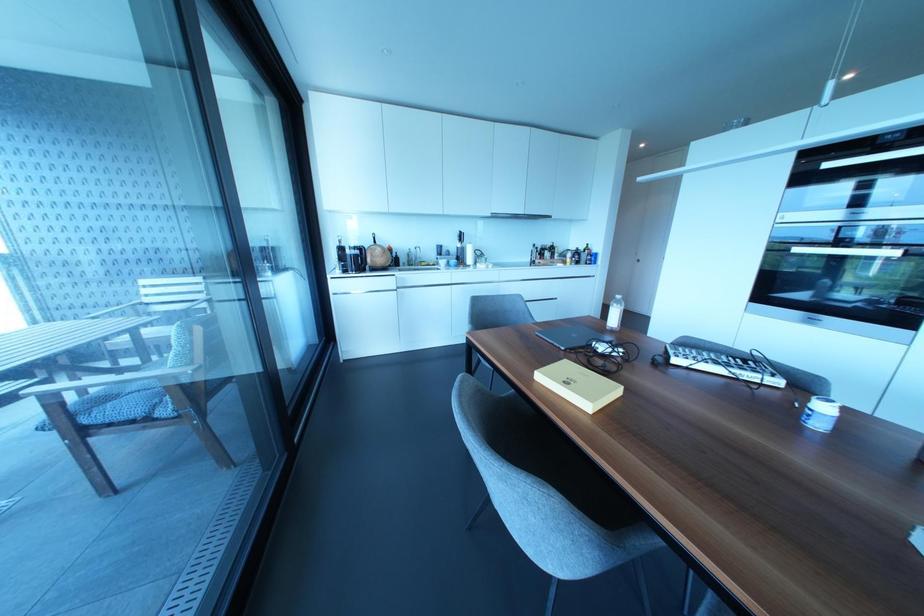
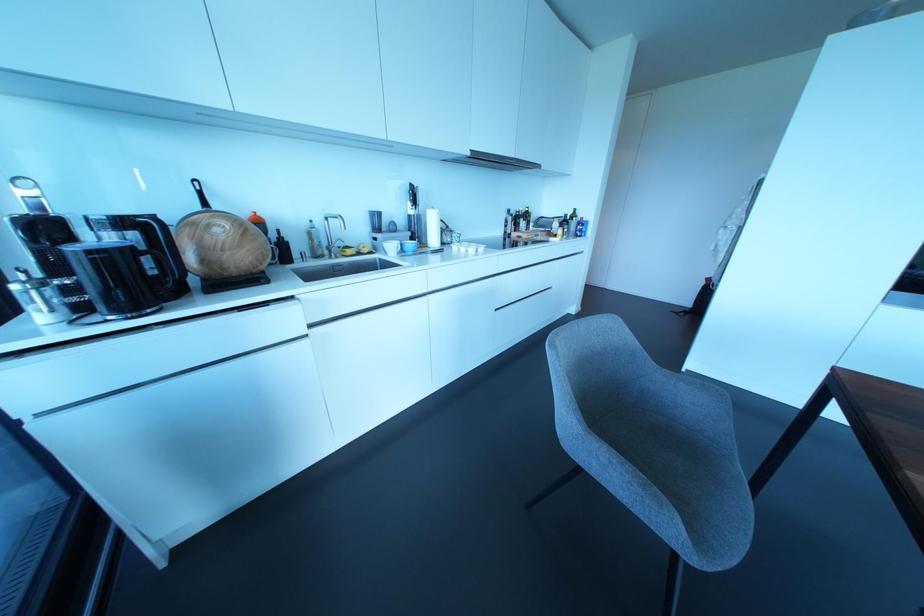
Where in the second image is the point corresponding to [447,261] from the first image?

(400, 244)